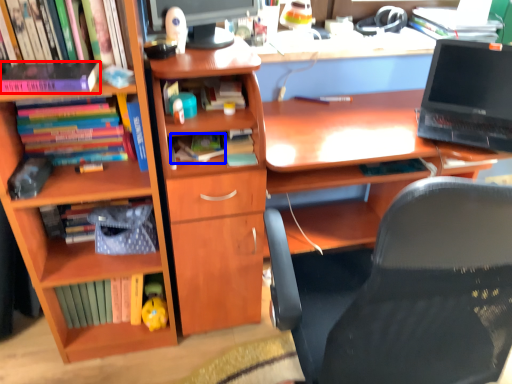
Question: Which of the following is the closest to the observer, book (highlighted by a red box) or book (highlighted by a blue box)?

Choices:
 (A) book
 (B) book

Answer: (A)